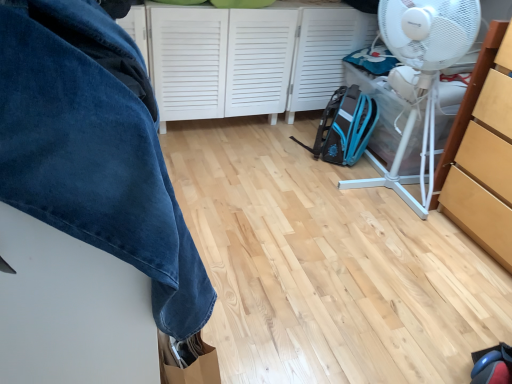
The image size is (512, 384). Identify the location of free space underneath white plastic mechanical fan at right (from a real-world perspective). (385, 190).